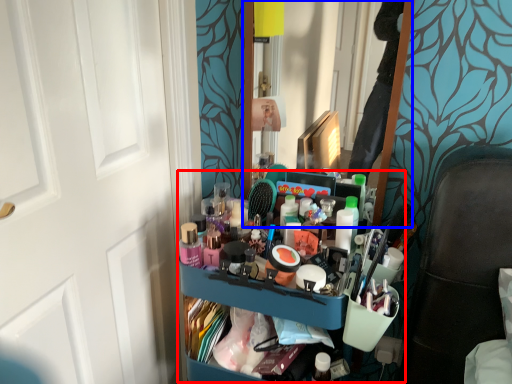
Question: Which object is closer to the camera taking this photo, bookshelf (highlighted by a red box) or mirror (highlighted by a blue box)?

Choices:
 (A) bookshelf
 (B) mirror

Answer: (A)